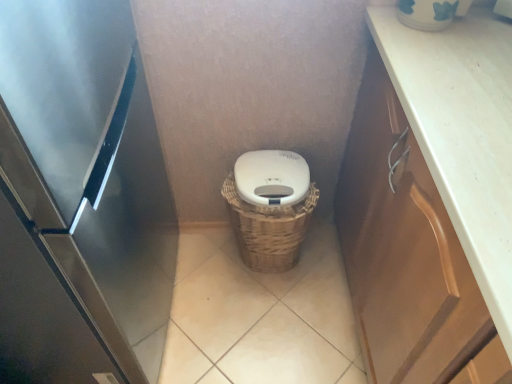
Question: Would you say beige tile at center is part of white matte lid at center's contents?

Choices:
 (A) yes
 (B) no

Answer: (B)

Question: Are white matte lid at center and beige tile at center far apart?

Choices:
 (A) yes
 (B) no

Answer: (B)

Question: Is white matte lid at center not within beige tile at center?

Choices:
 (A) no
 (B) yes

Answer: (B)

Question: From a real-world perspective, is white matte lid at center physically above beige tile at center?

Choices:
 (A) yes
 (B) no

Answer: (A)

Question: Does white matte lid at center come behind beige tile at center?

Choices:
 (A) yes
 (B) no

Answer: (B)

Question: From the image's perspective, is woven brown basket at center above or below beige tile at center?

Choices:
 (A) below
 (B) above

Answer: (B)

Question: From a real-world perspective, relative to beige tile at center, is woven brown basket at center vertically above or below?

Choices:
 (A) below
 (B) above

Answer: (B)

Question: Considering the positions of woven brown basket at center and beige tile at center in the image, is woven brown basket at center taller or shorter than beige tile at center?

Choices:
 (A) short
 (B) tall

Answer: (B)

Question: Relative to beige tile at center, is woven brown basket at center in front or behind?

Choices:
 (A) front
 (B) behind

Answer: (B)

Question: Considering the positions of woven brown basket at center and white matte lid at center in the image, is woven brown basket at center taller or shorter than white matte lid at center?

Choices:
 (A) tall
 (B) short

Answer: (A)

Question: Considering the relative positions of woven brown basket at center and white matte lid at center in the image provided, is woven brown basket at center to the left or to the right of white matte lid at center?

Choices:
 (A) left
 (B) right

Answer: (A)

Question: From a real-world perspective, relative to white matte lid at center, is woven brown basket at center vertically above or below?

Choices:
 (A) below
 (B) above

Answer: (A)

Question: Is woven brown basket at center spatially inside white matte lid at center, or outside of it?

Choices:
 (A) outside
 (B) inside

Answer: (A)

Question: Is stainless steel refrigerator at left bigger or smaller than beige tile at center?

Choices:
 (A) small
 (B) big

Answer: (B)

Question: Is stainless steel refrigerator at left wider or thinner than beige tile at center?

Choices:
 (A) wide
 (B) thin

Answer: (B)